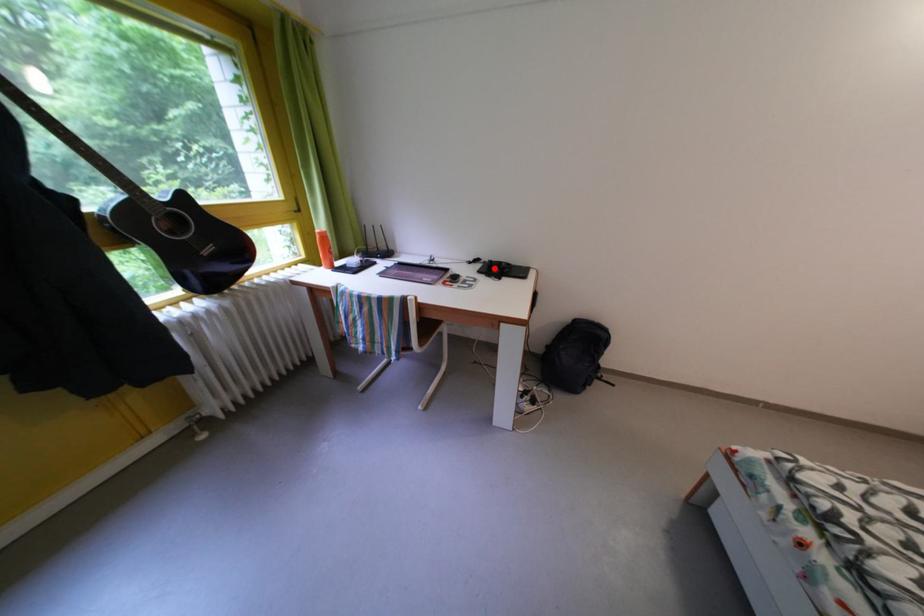
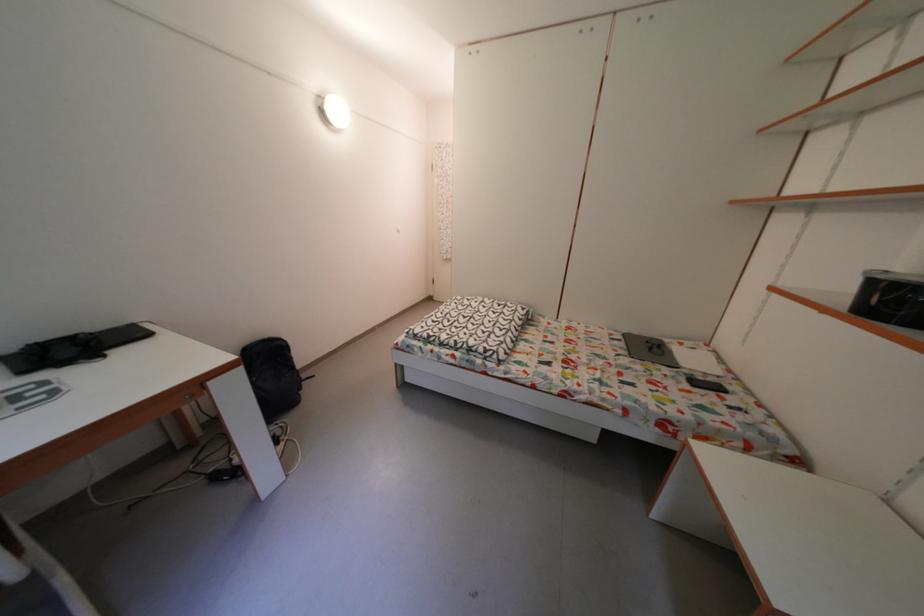
The point at the highlighted location is marked in the first image. Where is the corresponding point in the second image?

(6, 363)